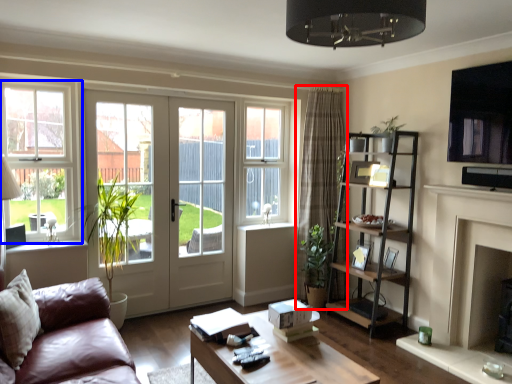
Question: Among these objects, which one is nearest to the camera, curtain (highlighted by a red box) or window (highlighted by a blue box)?

Choices:
 (A) curtain
 (B) window

Answer: (B)